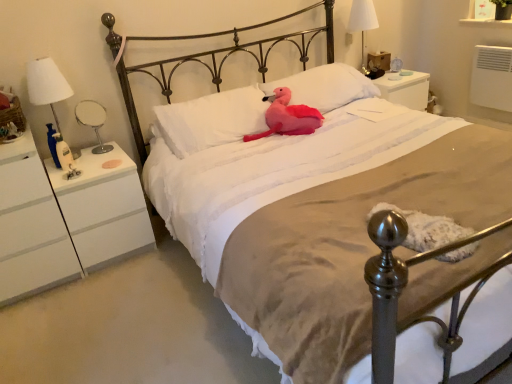
Where is `white soft pillow at center, which is counted as the second pillow, starting from the right`? This screenshot has width=512, height=384. white soft pillow at center, which is counted as the second pillow, starting from the right is located at coordinates (211, 120).

How much space does metallic mirror at left, positioned as the second bedside lamp in back-to-front order, occupy vertically?

The height of metallic mirror at left, positioned as the second bedside lamp in back-to-front order, is 10.62 inches.

In order to face white soft pillow at center, which is the 1th pillow from right to left, should I rotate leftwards or rightwards?

To align with it, rotate right about 8.585°.

The height and width of the screenshot is (384, 512). I want to click on white soft pillow at center, which is the 1th pillow from right to left, so (x=325, y=86).

Measure the distance between point [369,16] and camera.

They are 9.55 feet apart.

Image resolution: width=512 pixels, height=384 pixels. In order to click on white fabric lampshade at upper right, the third bedside lamp viewed from the front in this screenshot , I will do `click(362, 23)`.

What are the coordinates of `pink plush toy at center` in the screenshot? It's located at (287, 117).

Which object is positioned more to the right, white soft pillow at center, which is counted as the second pillow, starting from the right, or white soft pillow at center, which is the 1th pillow from right to left?

white soft pillow at center, which is the 1th pillow from right to left.

Is white soft pillow at center, which is counted as the second pillow, starting from the right, wider or thinner than white soft pillow at center, the second pillow in the left-to-right sequence?

Considering their sizes, white soft pillow at center, which is counted as the second pillow, starting from the right, looks slimmer than white soft pillow at center, the second pillow in the left-to-right sequence.

Does white soft pillow at center, which is counted as the second pillow, starting from the right, lie in front of white soft pillow at center, the second pillow in the left-to-right sequence?

Yes, the depth of white soft pillow at center, which is counted as the second pillow, starting from the right, is less than that of white soft pillow at center, the second pillow in the left-to-right sequence.

Is white soft pillow at center, which is the 1th pillow from right to left, located within white soft pillow at center, which is the first pillow in left-to-right order?

No, white soft pillow at center, which is the 1th pillow from right to left, is not a part of white soft pillow at center, which is the first pillow in left-to-right order.

Can you confirm if pink plush toy at center is positioned to the right of white soft pillow at center, the second pillow in the left-to-right sequence?

No, pink plush toy at center is not to the right of white soft pillow at center, the second pillow in the left-to-right sequence.

What's the angular difference between pink plush toy at center and white soft pillow at center, which is the 1th pillow from right to left,'s facing directions?

They differ by 4.78 degrees in their facing directions.

Considering the positions of points (301, 110) and (315, 86), is point (301, 110) farther from camera compared to point (315, 86)?

No, (301, 110) is closer to viewer.

Is white soft pillow at center, the second pillow in the left-to-right sequence, located within pink plush toy at center?

No, white soft pillow at center, the second pillow in the left-to-right sequence, is located outside of pink plush toy at center.

From the image's perspective, is metallic mirror at left, the 1th bedside lamp positioned from the bottom, under white fabric lampshade at upper right, arranged as the first bedside lamp when viewed from the top?

Indeed, from the image's perspective, metallic mirror at left, the 1th bedside lamp positioned from the bottom, is shown beneath white fabric lampshade at upper right, arranged as the first bedside lamp when viewed from the top.

Is metallic mirror at left, positioned as the second bedside lamp in back-to-front order, turned away from white fabric lampshade at upper right, the third bedside lamp viewed from the front?

metallic mirror at left, positioned as the second bedside lamp in back-to-front order, does not have its back to white fabric lampshade at upper right, the third bedside lamp viewed from the front.

Considering the positions of objects metallic mirror at left, the 1th bedside lamp positioned from the bottom, and white fabric lampshade at upper right, which ranks as the 1th bedside lamp in back-to-front order, in the image provided, who is in front, metallic mirror at left, the 1th bedside lamp positioned from the bottom, or white fabric lampshade at upper right, which ranks as the 1th bedside lamp in back-to-front order,?

metallic mirror at left, the 1th bedside lamp positioned from the bottom, is more forward.

You are a GUI agent. You are given a task and a screenshot of the screen. Output one action in this format:
    pyautogui.click(x=<x>, y=<y>)
    Task: Click on the bedside lamp that is behind the metallic mirror at left, the 1th bedside lamp positioned from the bottom
    Image resolution: width=512 pixels, height=384 pixels.
    Given the screenshot: What is the action you would take?
    pyautogui.click(x=362, y=23)

From the image's perspective, which is below, metallic mirror at left, placed as the second bedside lamp when sorted from left to right, or pink plush toy at center?

metallic mirror at left, placed as the second bedside lamp when sorted from left to right, is shown below in the image.

Measure the distance between metallic mirror at left, placed as the second bedside lamp when sorted from left to right, and pink plush toy at center.

metallic mirror at left, placed as the second bedside lamp when sorted from left to right, and pink plush toy at center are 3.32 feet apart from each other.

Is metallic mirror at left, the 2th bedside lamp positioned from the front, positioned far away from pink plush toy at center?

Yes, metallic mirror at left, the 2th bedside lamp positioned from the front, and pink plush toy at center are quite far apart.

Does metallic mirror at left, placed as the second bedside lamp when sorted from left to right, turn towards pink plush toy at center?

No, metallic mirror at left, placed as the second bedside lamp when sorted from left to right, is not aimed at pink plush toy at center.

From the image's perspective, who appears lower, white fabric lampshade at left, the 1th bedside lamp viewed from the front, or white soft pillow at center, which is counted as the second pillow, starting from the right?

white fabric lampshade at left, the 1th bedside lamp viewed from the front, is shown below in the image.

Looking at this image, is white fabric lampshade at left, acting as the 2th bedside lamp starting from the bottom, positioned with its back to white soft pillow at center, which is counted as the second pillow, starting from the right?

No, white fabric lampshade at left, acting as the 2th bedside lamp starting from the bottom, is not facing the opposite direction of white soft pillow at center, which is counted as the second pillow, starting from the right.

In the scene shown: Is white fabric lampshade at left, the 1th bedside lamp viewed from the front, wider or thinner than white soft pillow at center, which is counted as the second pillow, starting from the right?

In the image, white fabric lampshade at left, the 1th bedside lamp viewed from the front, appears to be more narrow than white soft pillow at center, which is counted as the second pillow, starting from the right.

From a real-world perspective, which object rests below the other?

white soft pillow at center, which is counted as the second pillow, starting from the right, from a real-world perspective.

Is white soft pillow at center, which is the 1th pillow from right to left, placed right next to white fabric lampshade at upper right, which ranks as the 1th bedside lamp in back-to-front order?

No, white soft pillow at center, which is the 1th pillow from right to left, is not in contact with white fabric lampshade at upper right, which ranks as the 1th bedside lamp in back-to-front order.

Considering the sizes of white soft pillow at center, the second pillow in the left-to-right sequence, and white fabric lampshade at upper right, marked as the first bedside lamp in a right-to-left arrangement, in the image, is white soft pillow at center, the second pillow in the left-to-right sequence, wider or thinner than white fabric lampshade at upper right, marked as the first bedside lamp in a right-to-left arrangement,?

white soft pillow at center, the second pillow in the left-to-right sequence, is wider than white fabric lampshade at upper right, marked as the first bedside lamp in a right-to-left arrangement.

Considering the positions of objects white soft pillow at center, which is the 1th pillow from right to left, and white fabric lampshade at upper right, marked as the 3th bedside lamp in a bottom-to-top arrangement, in the image provided, who is in front, white soft pillow at center, which is the 1th pillow from right to left, or white fabric lampshade at upper right, marked as the 3th bedside lamp in a bottom-to-top arrangement,?

white soft pillow at center, which is the 1th pillow from right to left, is closer to the camera.

Which of these two, pink plush toy at center or white matte nightstand at left, stands shorter?

pink plush toy at center is shorter.

Is pink plush toy at center inside the boundaries of white matte nightstand at left, or outside?

pink plush toy at center lies outside white matte nightstand at left.

Is pink plush toy at center wider than white matte nightstand at left?

Incorrect, the width of pink plush toy at center does not surpass that of white matte nightstand at left.

Can you tell me how much pink plush toy at center and white matte nightstand at left differ in facing direction?

8.38 degrees separate the facing orientations of pink plush toy at center and white matte nightstand at left.

Locate an element on the screen. This screenshot has height=384, width=512. pillow that appears above the white soft pillow at center, which is the first pillow in left-to-right order (from the image's perspective) is located at coordinates (325, 86).

Where is `pillow lying behind the pink plush toy at center`? The image size is (512, 384). pillow lying behind the pink plush toy at center is located at coordinates (325, 86).

Estimate the real-world distances between objects in this image. Which object is closer to white matte nightstand at left, white soft pillow at center, the second pillow in the left-to-right sequence, or white soft pillow at center, which is the first pillow in left-to-right order?

Based on the image, white soft pillow at center, which is the first pillow in left-to-right order, appears to be nearer to white matte nightstand at left.

Which object lies nearer to the anchor point white fabric lampshade at upper right, which ranks as the 1th bedside lamp in back-to-front order, white soft pillow at center, which is the 1th pillow from right to left, or white matte nightstand at left?

Based on the image, white soft pillow at center, which is the 1th pillow from right to left, appears to be nearer to white fabric lampshade at upper right, which ranks as the 1th bedside lamp in back-to-front order.

Estimate the real-world distances between objects in this image. Which object is closer to metallic mirror at left, which is the 3th bedside lamp from top to bottom, white soft pillow at center, which is the first pillow in left-to-right order, or white fabric lampshade at upper right, the third bedside lamp viewed from the front?

white soft pillow at center, which is the first pillow in left-to-right order, is closer to metallic mirror at left, which is the 3th bedside lamp from top to bottom.

Based on their spatial positions, is white fabric lampshade at upper right, marked as the 3th bedside lamp in a bottom-to-top arrangement, or white matte nightstand at left further from white soft pillow at center, which is the 1th pillow from right to left?

white matte nightstand at left lies further to white soft pillow at center, which is the 1th pillow from right to left, than the other object.

Looking at the image, which one is located closer to white matte nightstand at left, white fabric lampshade at left, which is counted as the second bedside lamp, starting from the top, or pink plush toy at center?

white fabric lampshade at left, which is counted as the second bedside lamp, starting from the top.

Estimate the real-world distances between objects in this image. Which object is closer to white fabric lampshade at left, acting as the 3th bedside lamp starting from the back, pink plush toy at center or metallic mirror at left, placed as the second bedside lamp when sorted from left to right?

metallic mirror at left, placed as the second bedside lamp when sorted from left to right, is closer to white fabric lampshade at left, acting as the 3th bedside lamp starting from the back.

From the image, which object appears to be nearer to white soft pillow at center, which is the first pillow in left-to-right order, metallic mirror at left, the 2th bedside lamp positioned from the front, or white fabric lampshade at upper right, arranged as the first bedside lamp when viewed from the top?

The object closer to white soft pillow at center, which is the first pillow in left-to-right order, is metallic mirror at left, the 2th bedside lamp positioned from the front.

Which object lies further to the anchor point white fabric lampshade at left, acting as the 2th bedside lamp starting from the bottom, white fabric lampshade at upper right, the third bedside lamp viewed from the front, or white soft pillow at center, which is counted as the second pillow, starting from the right?

white fabric lampshade at upper right, the third bedside lamp viewed from the front, is further to white fabric lampshade at left, acting as the 2th bedside lamp starting from the bottom.

Where is `animal situated between white soft pillow at center, which is counted as the second pillow, starting from the right, and white fabric lampshade at upper right, arranged as the first bedside lamp when viewed from the top, from left to right`? This screenshot has width=512, height=384. animal situated between white soft pillow at center, which is counted as the second pillow, starting from the right, and white fabric lampshade at upper right, arranged as the first bedside lamp when viewed from the top, from left to right is located at coordinates (287, 117).

Where is `nightstand between metallic mirror at left, which is the 3th bedside lamp from top to bottom, and white soft pillow at center, which is counted as the second pillow, starting from the right`? nightstand between metallic mirror at left, which is the 3th bedside lamp from top to bottom, and white soft pillow at center, which is counted as the second pillow, starting from the right is located at coordinates (65, 218).

This screenshot has height=384, width=512. I want to click on pillow situated between white fabric lampshade at left, which is counted as the second bedside lamp, starting from the top, and white soft pillow at center, the second pillow in the left-to-right sequence, from left to right, so click(211, 120).

The height and width of the screenshot is (384, 512). In order to click on bedside lamp between white fabric lampshade at left, which is counted as the second bedside lamp, starting from the top, and pink plush toy at center, in the horizontal direction in this screenshot , I will do `click(93, 121)`.